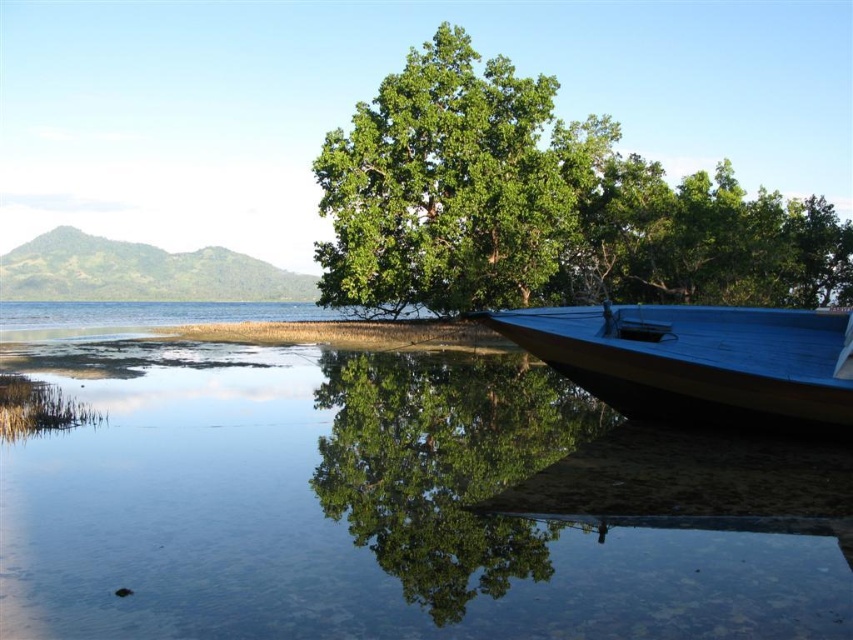
You are a photographer aiming to capture the reflection of the large green tree in the image. You are positioned at the edge of the water. Which object, the clear water at lower left or the blue polished wood boat at lower right, is closer to you to ensure the reflection is sharp?

The clear water at lower left is closer to the viewer than the blue polished wood boat at lower right, so you should focus on the clear water at lower left to capture the reflection sharply.

You are standing on the sandbar where the green leafy tree at center is growing. You want to walk to the blue polished wood boat at lower right. Which direction should you head towards?

Since the green leafy tree at center is further to the viewer than the blue polished wood boat at lower right, you should head away from the tree towards the direction of the boat.